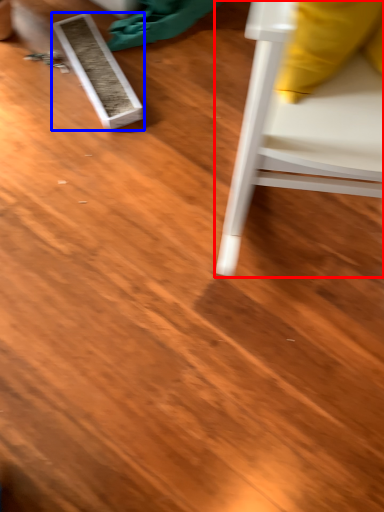
Question: Which object is closer to the camera taking this photo, furniture (highlighted by a red box) or plank (highlighted by a blue box)?

Choices:
 (A) furniture
 (B) plank

Answer: (A)